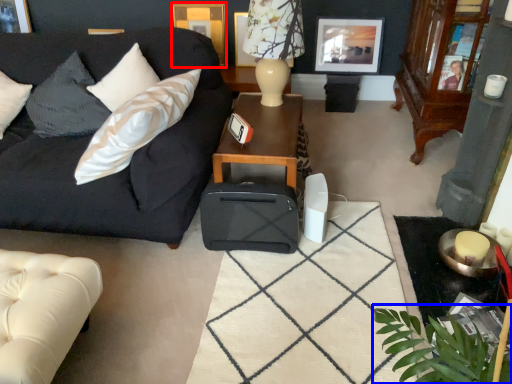
Question: Which object appears farthest to the camera in this image, picture frame (highlighted by a red box) or plant (highlighted by a blue box)?

Choices:
 (A) picture frame
 (B) plant

Answer: (A)